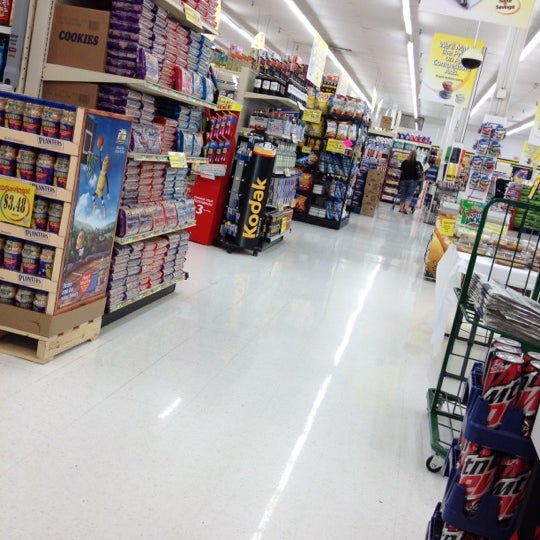
Find the location of a particular element. This screenshot has height=540, width=540. security camera is located at coordinates (468, 60).